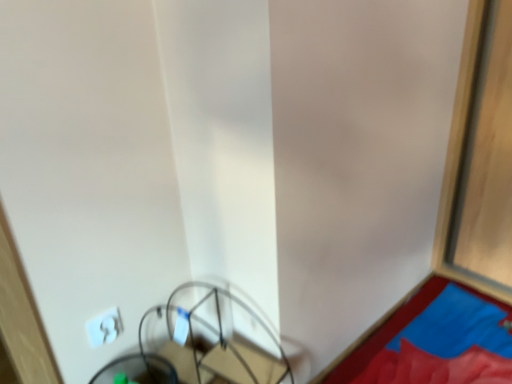
Question: Is blue fabric at lower right touching metallic wire swivel chair at lower left?

Choices:
 (A) no
 (B) yes

Answer: (A)

Question: Can you confirm if blue fabric at lower right is smaller than metallic wire swivel chair at lower left?

Choices:
 (A) no
 (B) yes

Answer: (A)

Question: Does blue fabric at lower right appear on the right side of metallic wire swivel chair at lower left?

Choices:
 (A) yes
 (B) no

Answer: (A)

Question: Is blue fabric at lower right to the left of metallic wire swivel chair at lower left from the viewer's perspective?

Choices:
 (A) yes
 (B) no

Answer: (B)

Question: Is blue fabric at lower right oriented away from metallic wire swivel chair at lower left?

Choices:
 (A) yes
 (B) no

Answer: (B)

Question: Considering the relative sizes of blue fabric at lower right and metallic wire swivel chair at lower left in the image provided, is blue fabric at lower right thinner than metallic wire swivel chair at lower left?

Choices:
 (A) yes
 (B) no

Answer: (B)

Question: Is metallic wire swivel chair at lower left at the right side of white plastic light switch at lower left?

Choices:
 (A) no
 (B) yes

Answer: (B)

Question: From the image's perspective, would you say metallic wire swivel chair at lower left is shown under white plastic light switch at lower left?

Choices:
 (A) yes
 (B) no

Answer: (A)

Question: Considering the relative sizes of metallic wire swivel chair at lower left and white plastic light switch at lower left in the image provided, is metallic wire swivel chair at lower left smaller than white plastic light switch at lower left?

Choices:
 (A) yes
 (B) no

Answer: (B)

Question: Does metallic wire swivel chair at lower left have a lesser height compared to white plastic light switch at lower left?

Choices:
 (A) yes
 (B) no

Answer: (B)

Question: Is metallic wire swivel chair at lower left bigger than white plastic light switch at lower left?

Choices:
 (A) no
 (B) yes

Answer: (B)

Question: Is metallic wire swivel chair at lower left positioned in front of white plastic light switch at lower left?

Choices:
 (A) no
 (B) yes

Answer: (B)

Question: From the image's perspective, is metallic wire swivel chair at lower left located beneath blue fabric at lower right?

Choices:
 (A) yes
 (B) no

Answer: (A)